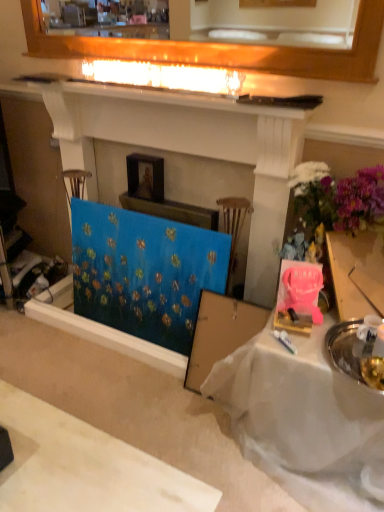
Question: Does blue fabric painting at center have a smaller size compared to white cloth-covered table at lower right?

Choices:
 (A) yes
 (B) no

Answer: (A)

Question: Are blue fabric painting at center and white cloth-covered table at lower right making contact?

Choices:
 (A) no
 (B) yes

Answer: (A)

Question: From the image's perspective, is blue fabric painting at center on white cloth-covered table at lower right?

Choices:
 (A) no
 (B) yes

Answer: (B)

Question: Is blue fabric painting at center wider than white cloth-covered table at lower right?

Choices:
 (A) no
 (B) yes

Answer: (A)

Question: From the image's perspective, is blue fabric painting at center under white cloth-covered table at lower right?

Choices:
 (A) no
 (B) yes

Answer: (A)

Question: Is blue fabric painting at center to the left of white cloth-covered table at lower right from the viewer's perspective?

Choices:
 (A) no
 (B) yes

Answer: (B)

Question: Does white glossy mantle at upper center come behind white cloth-covered table at lower right?

Choices:
 (A) yes
 (B) no

Answer: (A)

Question: Can you confirm if white glossy mantle at upper center is taller than white cloth-covered table at lower right?

Choices:
 (A) yes
 (B) no

Answer: (B)

Question: Is white glossy mantle at upper center shorter than white cloth-covered table at lower right?

Choices:
 (A) yes
 (B) no

Answer: (A)

Question: Is white glossy mantle at upper center facing towards white cloth-covered table at lower right?

Choices:
 (A) no
 (B) yes

Answer: (A)

Question: Is white cloth-covered table at lower right at the back of white glossy mantle at upper center?

Choices:
 (A) no
 (B) yes

Answer: (A)

Question: Is white glossy mantle at upper center to the left of white cloth-covered table at lower right from the viewer's perspective?

Choices:
 (A) yes
 (B) no

Answer: (A)

Question: Considering the relative sizes of blue canvas at center and blue fabric painting at center in the image provided, is blue canvas at center wider than blue fabric painting at center?

Choices:
 (A) no
 (B) yes

Answer: (B)